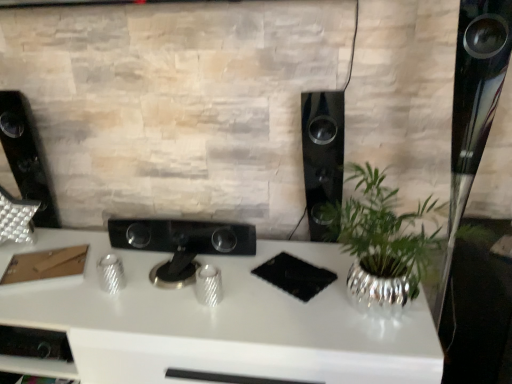
Identify the location of free space in front of black glossy controller at center. This screenshot has height=384, width=512. (168, 306).